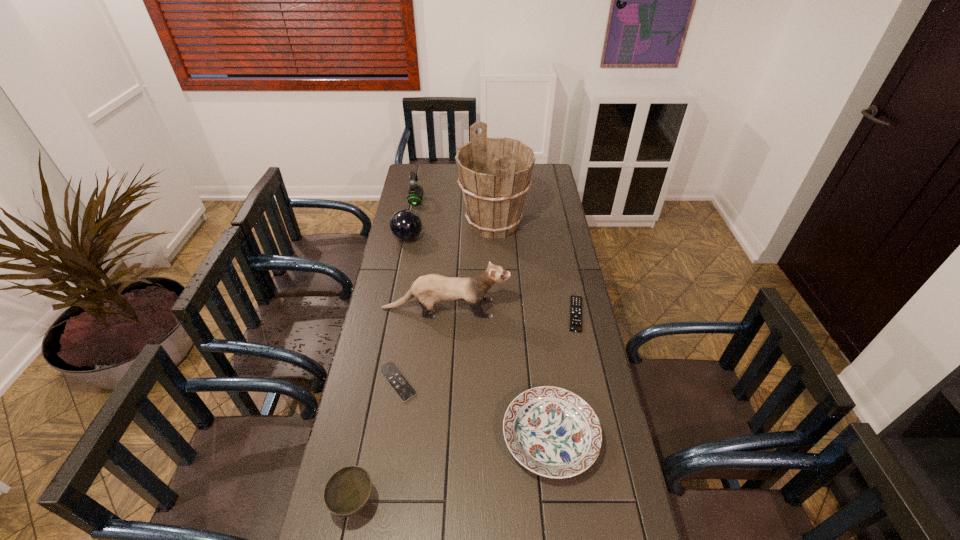
This screenshot has width=960, height=540. What are the coordinates of `vacant space located 0.290m on the back of the bucket` in the screenshot? It's located at (492, 174).

I want to click on vacant space located on the face of the seventh shortest object, so click(x=585, y=308).

The width and height of the screenshot is (960, 540). I want to click on free space located on the ear cups of the headset, so click(x=485, y=202).

Image resolution: width=960 pixels, height=540 pixels. I want to click on free location located 0.120m on the side of the bowling ball with the finger holes, so click(450, 238).

You are a GUI agent. You are given a task and a screenshot of the screen. Output one action in this format:
    pyautogui.click(x=<x>, y=<y>)
    Task: Click on the vacant space positioned on the right of the fifth tallest object
    This screenshot has width=960, height=540.
    Given the screenshot: What is the action you would take?
    pyautogui.click(x=457, y=502)

Identify the location of vacant area located on the back of the plate. This screenshot has height=540, width=960. (539, 338).

Identify the location of vacant region located on the front of the second shortest object. (592, 392).

This screenshot has width=960, height=540. I want to click on free space located on the front of the shorter remote control, so click(x=386, y=456).

Where is `ferret positioned at the left edge`? This screenshot has width=960, height=540. ferret positioned at the left edge is located at coordinates (430, 289).

Image resolution: width=960 pixels, height=540 pixels. What are the coordinates of `headset present at the left edge` in the screenshot? It's located at (415, 191).